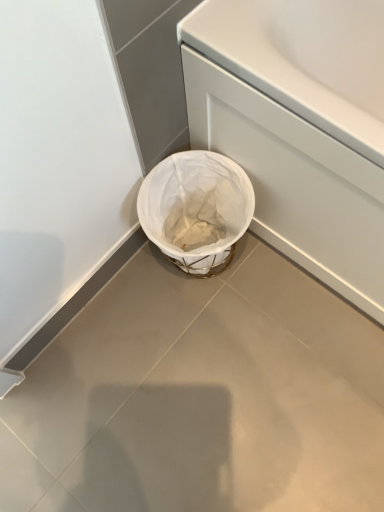
Where is `white fabric basket at lower center`? The height and width of the screenshot is (512, 384). white fabric basket at lower center is located at coordinates (196, 209).

This screenshot has height=512, width=384. In order to click on white fabric basket at lower center in this screenshot , I will do `click(196, 209)`.

Is white matte bath at lower right at the back of white fabric basket at lower center?

Yes, white matte bath at lower right is at the back of white fabric basket at lower center.

Based on the photo, is white fabric basket at lower center bigger or smaller than white matte bath at lower right?

white fabric basket at lower center is smaller than white matte bath at lower right.

The height and width of the screenshot is (512, 384). Identify the location of bath located above the white fabric basket at lower center (from a real-world perspective). (299, 127).

Considering the positions of objects white fabric basket at lower center and white matte bath at lower right in the image provided, who is more to the right, white fabric basket at lower center or white matte bath at lower right?

white matte bath at lower right is more to the right.

Based on the photo, choose the correct answer: Is white fabric basket at lower center inside white fabric basket at lower center or outside it?

white fabric basket at lower center is not enclosed by white fabric basket at lower center.

Based on the photo, considering the sizes of white fabric basket at lower center and white fabric basket at lower center in the image, is white fabric basket at lower center taller or shorter than white fabric basket at lower center?

white fabric basket at lower center is taller than white fabric basket at lower center.

From a real-world perspective, is white fabric basket at lower center beneath white fabric basket at lower center?

No, from a real-world perspective, white fabric basket at lower center is not below white fabric basket at lower center.

Identify the location of concrete below the white fabric basket at lower center (from the image's perspective). The image size is (384, 512). (202, 397).

In the scene shown: Does white fabric basket at lower center have a lesser width compared to white matte bath at lower right?

No, white fabric basket at lower center is not thinner than white matte bath at lower right.

From a real-world perspective, is white fabric basket at lower center physically located above or below white matte bath at lower right?

Answer: In terms of real-world spatial position, white fabric basket at lower center is below white matte bath at lower right.

Is white fabric basket at lower center completely or partially outside of white matte bath at lower right?

white fabric basket at lower center is positioned outside white matte bath at lower right.

Considering the sizes of objects white fabric basket at lower center and white matte bath at lower right in the image provided, who is shorter, white fabric basket at lower center or white matte bath at lower right?

white fabric basket at lower center is shorter.

Considering the relative sizes of white fabric basket at lower center and white fabric basket at lower center in the image provided, is white fabric basket at lower center bigger than white fabric basket at lower center?

No.

Which is in front, white fabric basket at lower center or white fabric basket at lower center?

white fabric basket at lower center is in front.

Is white fabric basket at lower center wider or thinner than white fabric basket at lower center?

In the image, white fabric basket at lower center appears to be wider than white fabric basket at lower center.

Is white fabric basket at lower center oriented towards white fabric basket at lower center?

No, white fabric basket at lower center is not facing towards white fabric basket at lower center.

Identify the location of waste container behind the white matte bath at lower right. (196, 209).

Are white matte bath at lower right and white fabric basket at lower center located far from each other?

white matte bath at lower right is near white fabric basket at lower center, not far away.

Is white matte bath at lower right looking in the opposite direction of white fabric basket at lower center?

white matte bath at lower right is not turned away from white fabric basket at lower center.

Is white matte bath at lower right taller than white fabric basket at lower center?

Correct, white matte bath at lower right is much taller as white fabric basket at lower center.

Is white fabric basket at lower center inside white matte bath at lower right?

Actually, white fabric basket at lower center is outside white matte bath at lower right.

Is the depth of white matte bath at lower right greater than that of white fabric basket at lower center?

No, the depth of white matte bath at lower right is less than that of white fabric basket at lower center.

This screenshot has height=512, width=384. In order to click on concrete that is on the left side of white matte bath at lower right in this screenshot , I will do `click(202, 397)`.

Is point (376, 202) closer or farther from the camera than point (260, 412)?

Clearly, point (376, 202) is closer to the camera than point (260, 412).

Where is `bath on the right of white fabric basket at lower center`? This screenshot has width=384, height=512. bath on the right of white fabric basket at lower center is located at coordinates (299, 127).

Where is `concrete located below the white fabric basket at lower center (from the image's perspective)`? concrete located below the white fabric basket at lower center (from the image's perspective) is located at coordinates (202, 397).

Considering their positions, is white fabric basket at lower center positioned closer to white matte bath at lower right than white fabric basket at lower center?

Among the two, white fabric basket at lower center is located nearer to white matte bath at lower right.

Estimate the real-world distances between objects in this image. Which object is closer to white fabric basket at lower center, white matte bath at lower right or white fabric basket at lower center?

The object closer to white fabric basket at lower center is white fabric basket at lower center.

From the image, which object appears to be farther from white fabric basket at lower center, white fabric basket at lower center or white matte bath at lower right?

Among the two, white matte bath at lower right is located further to white fabric basket at lower center.

Based on their spatial positions, is white fabric basket at lower center or white matte bath at lower right further from white fabric basket at lower center?

The object further to white fabric basket at lower center is white fabric basket at lower center.

Considering their positions, is white fabric basket at lower center positioned closer to white matte bath at lower right than white fabric basket at lower center?

white fabric basket at lower center lies closer to white matte bath at lower right than the other object.

Which object lies further to the anchor point white fabric basket at lower center, white matte bath at lower right or white fabric basket at lower center?

white fabric basket at lower center is positioned further to the anchor white fabric basket at lower center.

What are the coordinates of `waste container that lies between white matte bath at lower right and white fabric basket at lower center from top to bottom` in the screenshot? It's located at (196, 209).